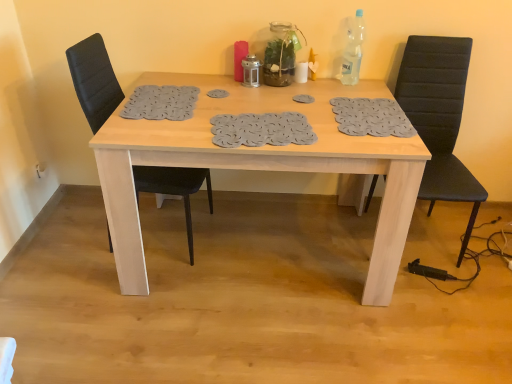
Question: Is black leather chair at right, arranged as the 2th chair when viewed from the left, not inside black leather chair at left, the second chair from the right?

Choices:
 (A) no
 (B) yes

Answer: (B)

Question: Does black leather chair at right, which is counted as the first chair, starting from the right, appear on the right side of black leather chair at left, the second chair from the right?

Choices:
 (A) no
 (B) yes

Answer: (B)

Question: Can you confirm if black leather chair at right, which is counted as the first chair, starting from the right, is taller than black leather chair at left, positioned as the 1th chair in left-to-right order?

Choices:
 (A) no
 (B) yes

Answer: (A)

Question: Considering the relative sizes of black leather chair at right, arranged as the 2th chair when viewed from the left, and black leather chair at left, the second chair from the right, in the image provided, is black leather chair at right, arranged as the 2th chair when viewed from the left, thinner than black leather chair at left, the second chair from the right,?

Choices:
 (A) no
 (B) yes

Answer: (A)

Question: Are black leather chair at right, arranged as the 2th chair when viewed from the left, and black leather chair at left, positioned as the 1th chair in left-to-right order, beside each other?

Choices:
 (A) yes
 (B) no

Answer: (B)

Question: Does black leather chair at right, which is counted as the first chair, starting from the right, appear on the left side of black leather chair at left, positioned as the 1th chair in left-to-right order?

Choices:
 (A) no
 (B) yes

Answer: (A)

Question: Is black leather chair at left, the second chair from the right, beside light wood table at center?

Choices:
 (A) no
 (B) yes

Answer: (A)

Question: From the image's perspective, is black leather chair at left, positioned as the 1th chair in left-to-right order, on light wood table at center?

Choices:
 (A) yes
 (B) no

Answer: (A)

Question: Considering the relative sizes of black leather chair at left, the second chair from the right, and light wood table at center in the image provided, is black leather chair at left, the second chair from the right, smaller than light wood table at center?

Choices:
 (A) yes
 (B) no

Answer: (A)

Question: Is black leather chair at left, the second chair from the right, located outside light wood table at center?

Choices:
 (A) no
 (B) yes

Answer: (A)

Question: Is black leather chair at left, positioned as the 1th chair in left-to-right order, turned away from light wood table at center?

Choices:
 (A) yes
 (B) no

Answer: (A)

Question: From the image's perspective, is black leather chair at left, positioned as the 1th chair in left-to-right order, located beneath light wood table at center?

Choices:
 (A) yes
 (B) no

Answer: (B)

Question: Considering the relative sizes of light wood table at center and black leather chair at left, positioned as the 1th chair in left-to-right order, in the image provided, is light wood table at center bigger than black leather chair at left, positioned as the 1th chair in left-to-right order,?

Choices:
 (A) no
 (B) yes

Answer: (B)